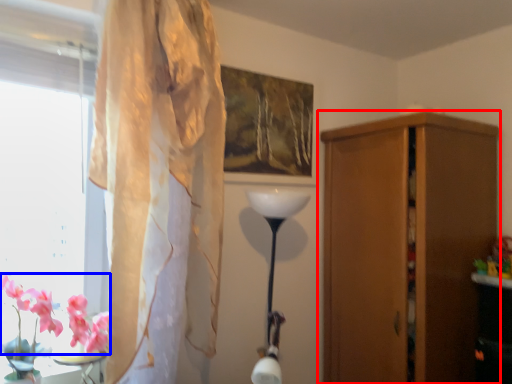
Question: Which object appears farthest to the camera in this image, cupboard (highlighted by a red box) or flower (highlighted by a blue box)?

Choices:
 (A) cupboard
 (B) flower

Answer: (A)